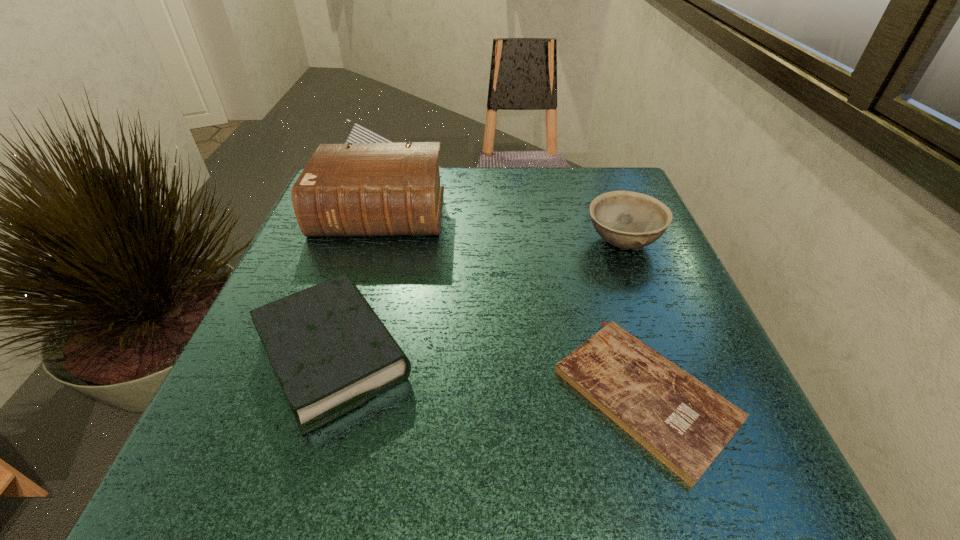
What are the coordinates of `free location that satisfies the following two spatial constraints: 1. on the spine side of the tallest Bible; 2. on the left side of the rightmost Bible` in the screenshot? It's located at (325, 395).